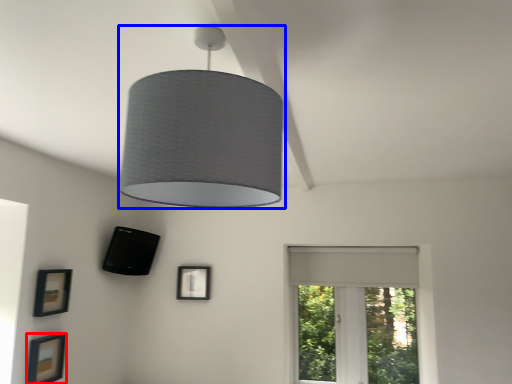
Question: Which object appears farthest to the camera in this image, picture frame (highlighted by a red box) or lamp (highlighted by a blue box)?

Choices:
 (A) picture frame
 (B) lamp

Answer: (A)